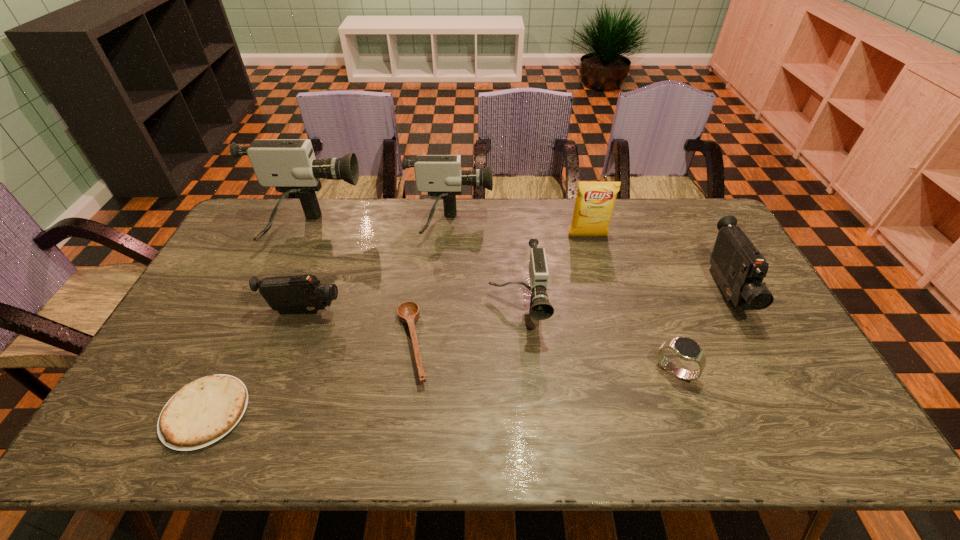
Locate an element on the screen. white camcorder that is the second closest to the biggest white camcorder is located at coordinates (540, 309).

At what (x,y) coordinates should I click in order to perform the action: click on the second closest white camcorder to the sixth tallest object. Please return your answer as a coordinate pair (x, y). Image resolution: width=960 pixels, height=540 pixels. Looking at the image, I should click on (441, 176).

Identify the location of blank space that satisfies the following two spatial constraints: 1. on the recording direction of the tallest object; 2. on the right side of the third shortest object. (247, 371).

Find the location of a particular element. The image size is (960, 540). free location that satisfies the following two spatial constraints: 1. on the back side of the eighth object from left to right; 2. on the left side of the beige tortilla is located at coordinates (226, 371).

This screenshot has width=960, height=540. I want to click on free space that satisfies the following two spatial constraints: 1. on the front-facing side of the watch; 2. on the left side of the fourth shortest object, so click(x=282, y=371).

Where is `vacant space that satisfies the following two spatial constraints: 1. on the recording direction of the nearest white camcorder; 2. on the front-facing side of the shortest camcorder`? Image resolution: width=960 pixels, height=540 pixels. vacant space that satisfies the following two spatial constraints: 1. on the recording direction of the nearest white camcorder; 2. on the front-facing side of the shortest camcorder is located at coordinates (517, 312).

The image size is (960, 540). I want to click on vacant area in the image that satisfies the following two spatial constraints: 1. on the recording direction of the watch; 2. on the right side of the smallest white camcorder, so click(521, 371).